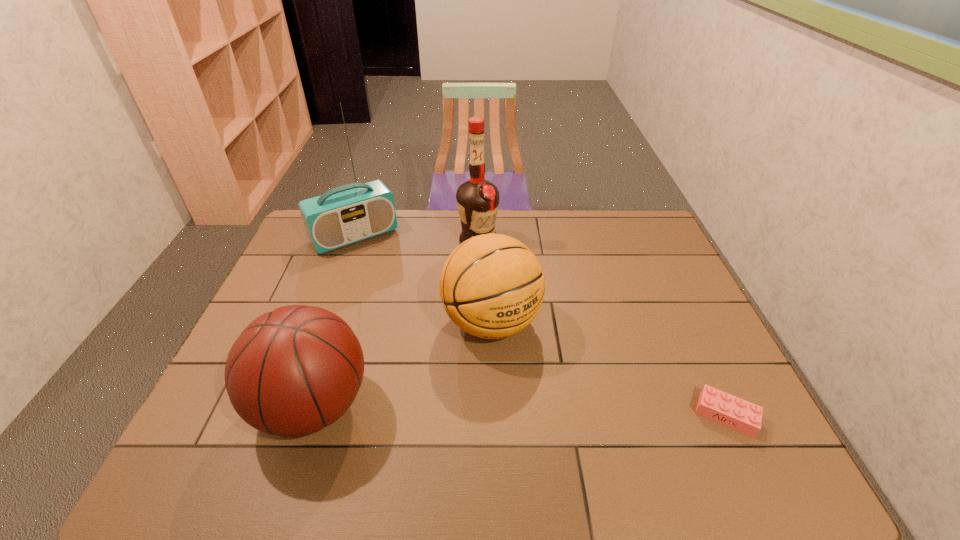
Locate an element on the screen. Lego that is at the near edge is located at coordinates (738, 414).

Where is `basketball located in the left edge section of the desktop`? Image resolution: width=960 pixels, height=540 pixels. basketball located in the left edge section of the desktop is located at coordinates (293, 371).

Locate an element on the screen. radio receiver that is at the left edge is located at coordinates (350, 213).

Identify the location of object that is at the right edge. This screenshot has height=540, width=960. coord(738,414).

Locate an element on the screen. The image size is (960, 540). object present at the far left corner is located at coordinates (350, 213).

Where is `object present at the near left corner`? This screenshot has height=540, width=960. object present at the near left corner is located at coordinates (293, 371).

I want to click on object located at the near right corner, so click(x=738, y=414).

Image resolution: width=960 pixels, height=540 pixels. In the image, there is a desktop. Find the location of `free space at the far edge`. free space at the far edge is located at coordinates (459, 227).

The image size is (960, 540). Identify the location of vacant space at the near edge of the desktop. (657, 416).

Locate an element on the screen. free space at the right edge of the desktop is located at coordinates (700, 389).